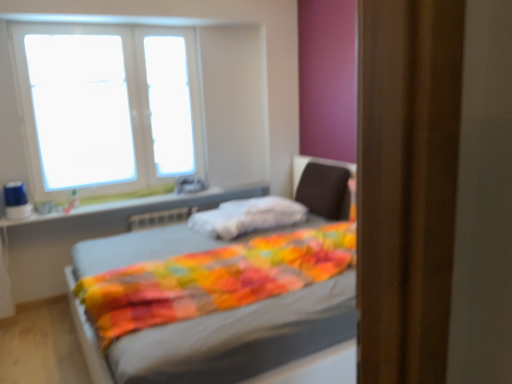
The height and width of the screenshot is (384, 512). What do you see at coordinates (325, 190) in the screenshot?
I see `dark brown fabric swivel chair at center` at bounding box center [325, 190].

The width and height of the screenshot is (512, 384). What do you see at coordinates (80, 110) in the screenshot?
I see `transparent glass window at upper left, marked as the second window screen in a right-to-left arrangement` at bounding box center [80, 110].

Measure the distance between multicolored quilted blanket at center and camera.

A distance of 9.60 feet exists between multicolored quilted blanket at center and camera.

What is the approximate height of multicolored quilted blanket at center?

multicolored quilted blanket at center is 7.62 inches in height.

Where is `white plastic window at upper left`? white plastic window at upper left is located at coordinates (109, 107).

Is white plastic window sill at upper left positioned with its back to multicolored quilted blanket at center?

No, multicolored quilted blanket at center is not at the back of white plastic window sill at upper left.

Considering the sizes of white plastic window sill at upper left and multicolored quilted blanket at center in the image, is white plastic window sill at upper left bigger or smaller than multicolored quilted blanket at center?

Considering their sizes, white plastic window sill at upper left takes up less space than multicolored quilted blanket at center.

Considering the relative sizes of white plastic window sill at upper left and multicolored quilted blanket at center in the image provided, is white plastic window sill at upper left taller than multicolored quilted blanket at center?

In fact, white plastic window sill at upper left may be shorter than multicolored quilted blanket at center.

Where is `window sill lying on the left of multicolored quilted blanket at center`? The height and width of the screenshot is (384, 512). window sill lying on the left of multicolored quilted blanket at center is located at coordinates (136, 208).

Is point (297, 218) in front of point (118, 214)?

Yes, point (297, 218) is in front of point (118, 214).

Could you measure the distance between multicolored quilted blanket at center and white plastic window sill at upper left?

multicolored quilted blanket at center is 30.79 inches away from white plastic window sill at upper left.

Considering the sizes of objects multicolored quilted blanket at center and white plastic window sill at upper left in the image provided, who is thinner, multicolored quilted blanket at center or white plastic window sill at upper left?

white plastic window sill at upper left.

Between multicolored quilted blanket at center and white plastic window sill at upper left, which one has more height?

multicolored quilted blanket at center is taller.

Identify the location of window that is above the transparent glass window at upper center, the 2th window screen viewed from the left (from a real-world perspective). This screenshot has width=512, height=384. (109, 107).

Considering the relative sizes of white plastic window at upper left and transparent glass window at upper center, the first window screen viewed from the right, in the image provided, is white plastic window at upper left bigger than transparent glass window at upper center, the first window screen viewed from the right,?

Correct, white plastic window at upper left is larger in size than transparent glass window at upper center, the first window screen viewed from the right.

Does white plastic window at upper left appear on the left side of transparent glass window at upper center, the 2th window screen viewed from the left?

Indeed, white plastic window at upper left is positioned on the left side of transparent glass window at upper center, the 2th window screen viewed from the left.

Are white plastic window at upper left and transparent glass window at upper center, the 2th window screen viewed from the left, far apart?

They are positioned close to each other.

Are white plastic window sill at upper left and transparent glass window at upper center, the first window screen viewed from the right, far apart?

Actually, white plastic window sill at upper left and transparent glass window at upper center, the first window screen viewed from the right, are a little close together.

Can you confirm if white plastic window sill at upper left is thinner than transparent glass window at upper center, the 2th window screen viewed from the left?

In fact, white plastic window sill at upper left might be wider than transparent glass window at upper center, the 2th window screen viewed from the left.

Is white plastic window sill at upper left spatially inside transparent glass window at upper center, the 2th window screen viewed from the left, or outside of it?

white plastic window sill at upper left is spatially situated outside transparent glass window at upper center, the 2th window screen viewed from the left.

Considering the relative positions of white plastic window sill at upper left and transparent glass window at upper center, the 2th window screen viewed from the left, in the image provided, is white plastic window sill at upper left to the left of transparent glass window at upper center, the 2th window screen viewed from the left, from the viewer's perspective?

Correct, you'll find white plastic window sill at upper left to the left of transparent glass window at upper center, the 2th window screen viewed from the left.

Is transparent glass window at upper left, marked as the second window screen in a right-to-left arrangement, to the left or to the right of white plastic window at upper left in the image?

transparent glass window at upper left, marked as the second window screen in a right-to-left arrangement, is to the left of white plastic window at upper left.

How different are the orientations of transparent glass window at upper left, marked as the second window screen in a right-to-left arrangement, and white plastic window at upper left in degrees?

transparent glass window at upper left, marked as the second window screen in a right-to-left arrangement, and white plastic window at upper left are facing 5.29e-05 degrees away from each other.

From the picture: Can you confirm if transparent glass window at upper left, the 1th window screen viewed from the left, is thinner than white plastic window at upper left?

Correct, the width of transparent glass window at upper left, the 1th window screen viewed from the left, is less than that of white plastic window at upper left.

Does point (101, 73) come in front of point (70, 101)?

That is False.

Does multicolored quilted blanket at center have a lesser width compared to transparent glass window at upper center, the first window screen viewed from the right?

No, multicolored quilted blanket at center is not thinner than transparent glass window at upper center, the first window screen viewed from the right.

Considering the sizes of objects multicolored quilted blanket at center and transparent glass window at upper center, the 2th window screen viewed from the left, in the image provided, who is shorter, multicolored quilted blanket at center or transparent glass window at upper center, the 2th window screen viewed from the left,?

multicolored quilted blanket at center.

Is multicolored quilted blanket at center looking in the opposite direction of transparent glass window at upper center, the first window screen viewed from the right?

No, multicolored quilted blanket at center is not facing away from transparent glass window at upper center, the first window screen viewed from the right.

In order to click on blanket below the transparent glass window at upper center, the first window screen viewed from the right (from the image's perspective) in this screenshot , I will do `click(247, 216)`.

Between white plastic window at upper left and dark brown fabric swivel chair at center, which one has more height?

white plastic window at upper left is taller.

In terms of size, does white plastic window at upper left appear bigger or smaller than dark brown fabric swivel chair at center?

In the image, white plastic window at upper left appears to be larger than dark brown fabric swivel chair at center.

Which of these two, white plastic window at upper left or dark brown fabric swivel chair at center, is wider?

Wider between the two is dark brown fabric swivel chair at center.

Find the location of a particular element. The width and height of the screenshot is (512, 384). window above the dark brown fabric swivel chair at center (from a real-world perspective) is located at coordinates (109, 107).

At what (x,y) coordinates should I click in order to perform the action: click on window sill above the multicolored quilted blanket at center (from a real-world perspective). Please return your answer as a coordinate pair (x, y). The image size is (512, 384). Looking at the image, I should click on (136, 208).

At what (x,y) coordinates should I click in order to perform the action: click on blanket below the white plastic window sill at upper left (from a real-world perspective). Please return your answer as a coordinate pair (x, y). Image resolution: width=512 pixels, height=384 pixels. Looking at the image, I should click on (247, 216).

Which object lies further to the anchor point dark brown fabric swivel chair at center, transparent glass window at upper center, the first window screen viewed from the right, or multicolored quilted blanket at center?

Based on the image, transparent glass window at upper center, the first window screen viewed from the right, appears to be further to dark brown fabric swivel chair at center.

Looking at the image, which one is located closer to transparent glass window at upper left, the 1th window screen viewed from the left, transparent glass window at upper center, the first window screen viewed from the right, or multicolored quilted blanket at center?

The object closer to transparent glass window at upper left, the 1th window screen viewed from the left, is transparent glass window at upper center, the first window screen viewed from the right.

When comparing their distances from multicolored quilted blanket at center, does transparent glass window at upper left, the 1th window screen viewed from the left, or transparent glass window at upper center, the 2th window screen viewed from the left, seem further?

transparent glass window at upper left, the 1th window screen viewed from the left, is further to multicolored quilted blanket at center.

Based on their spatial positions, is transparent glass window at upper left, marked as the second window screen in a right-to-left arrangement, or multicolored quilted blanket at center further from white plastic window at upper left?

multicolored quilted blanket at center is further to white plastic window at upper left.

Estimate the real-world distances between objects in this image. Which object is closer to white plastic window at upper left, dark brown fabric swivel chair at center or white plastic window sill at upper left?

The object closer to white plastic window at upper left is white plastic window sill at upper left.

Which object lies nearer to the anchor point white plastic window at upper left, transparent glass window at upper left, marked as the second window screen in a right-to-left arrangement, or dark brown fabric swivel chair at center?

Based on the image, transparent glass window at upper left, marked as the second window screen in a right-to-left arrangement, appears to be nearer to white plastic window at upper left.

When comparing their distances from white plastic window sill at upper left, does dark brown fabric swivel chair at center or multicolored quilted blanket at center seem further?

Based on the image, dark brown fabric swivel chair at center appears to be further to white plastic window sill at upper left.

Considering their positions, is white plastic window sill at upper left positioned closer to transparent glass window at upper left, the 1th window screen viewed from the left, than white plastic window at upper left?

white plastic window at upper left is positioned closer to the anchor transparent glass window at upper left, the 1th window screen viewed from the left.

Identify the location of blanket between white plastic window sill at upper left and dark brown fabric swivel chair at center from left to right. The height and width of the screenshot is (384, 512). (247, 216).

What are the coordinates of `window sill between transparent glass window at upper left, marked as the second window screen in a right-to-left arrangement, and multicolored quilted blanket at center from left to right` in the screenshot? It's located at (136, 208).

This screenshot has width=512, height=384. I want to click on window sill situated between white plastic window at upper left and dark brown fabric swivel chair at center from left to right, so click(x=136, y=208).

Where is `window sill between white plastic window at upper left and multicolored quilted blanket at center in the horizontal direction`? The image size is (512, 384). window sill between white plastic window at upper left and multicolored quilted blanket at center in the horizontal direction is located at coordinates (136, 208).